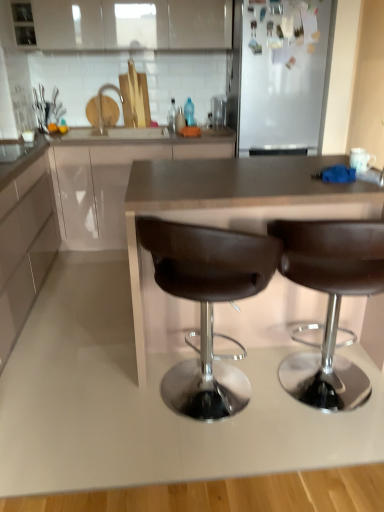
Find the location of a particular element. blank space situated above brown leather stool at center, acting as the 2th chair starting from the left (from a real-world perspective) is located at coordinates (331, 192).